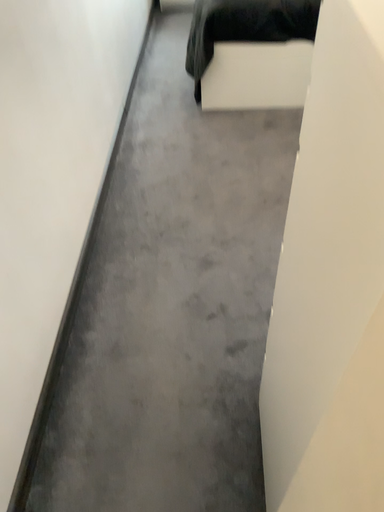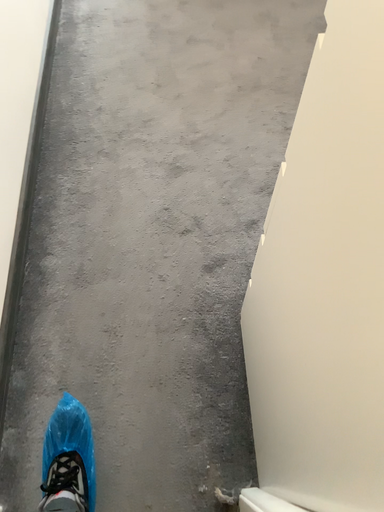
Question: Which way did the camera rotate in the video?

Choices:
 (A) rotated upward
 (B) rotated downward

Answer: (B)